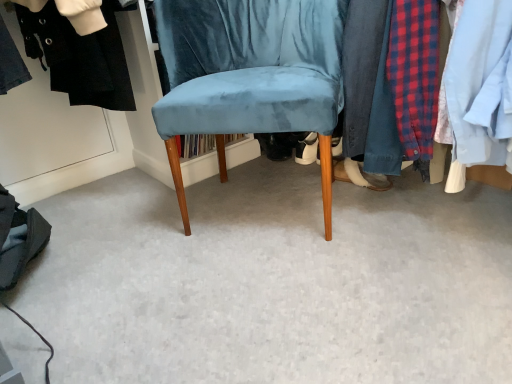
Looking at this image, in order to face velvet blue chair at center, should I rotate leftwards or rightwards?

To face it directly, rotate right by 0.282 degrees.

Describe the element at coordinates (248, 70) in the screenshot. Image resolution: width=512 pixels, height=384 pixels. I see `velvet blue chair at center` at that location.

Locate an element on the screen. The width and height of the screenshot is (512, 384). velvet blue chair at center is located at coordinates (248, 70).

This screenshot has width=512, height=384. I want to click on velvet blue chair at center, so click(x=248, y=70).